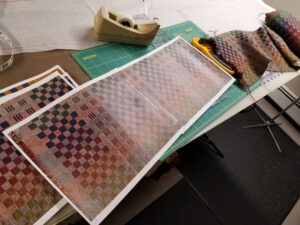
I want to click on tablecloth, so click(45, 31).